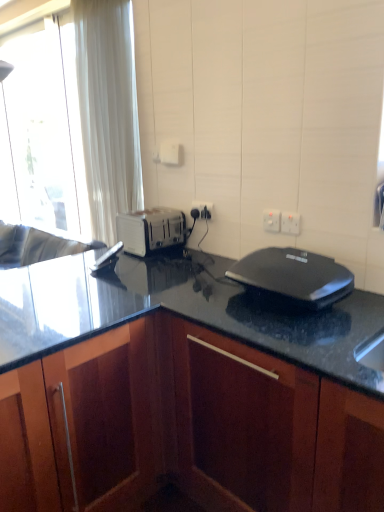
Where is `free space in front of black plastic sandwich maker at center`? Image resolution: width=384 pixels, height=512 pixels. free space in front of black plastic sandwich maker at center is located at coordinates (311, 334).